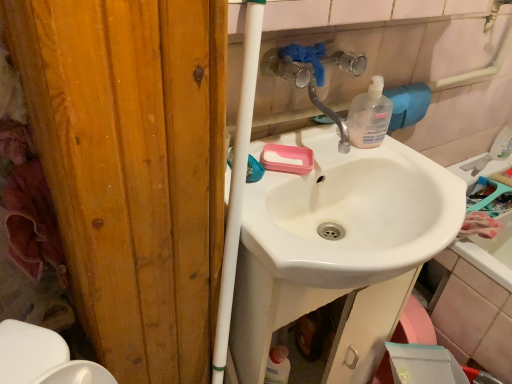
Question: Is translucent plastic soap dispenser at upper right in front of or behind pink matte soap at center in the image?

Choices:
 (A) behind
 (B) front

Answer: (A)

Question: Looking at the image, does translucent plastic soap dispenser at upper right seem bigger or smaller compared to pink matte soap at center?

Choices:
 (A) big
 (B) small

Answer: (A)

Question: Which is farther from the pink matte soap at center?

Choices:
 (A) clear plastic faucet at upper center
 (B) white glossy sink at center
 (C) translucent plastic soap dispenser at upper right

Answer: (B)

Question: Estimate the real-world distances between objects in this image. Which object is closer to the pink matte soap at center?

Choices:
 (A) clear plastic faucet at upper center
 (B) translucent plastic soap dispenser at upper right
 (C) white glossy sink at center

Answer: (A)